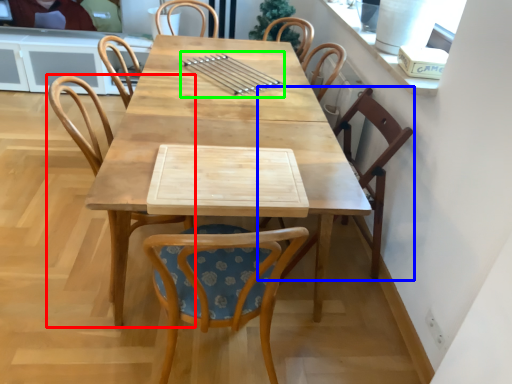
Question: Which object is positioned farthest from chair (highlighted by a red box)? Select from chair (highlighted by a blue box) and tableware (highlighted by a green box).

Choices:
 (A) chair
 (B) tableware

Answer: (A)